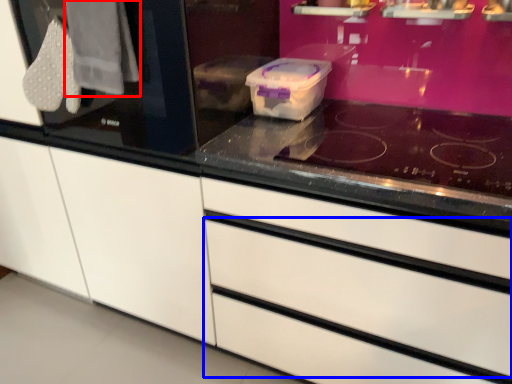
Question: Among these objects, which one is nearest to the camera, clothe (highlighted by a red box) or drawer (highlighted by a blue box)?

Choices:
 (A) clothe
 (B) drawer

Answer: (B)